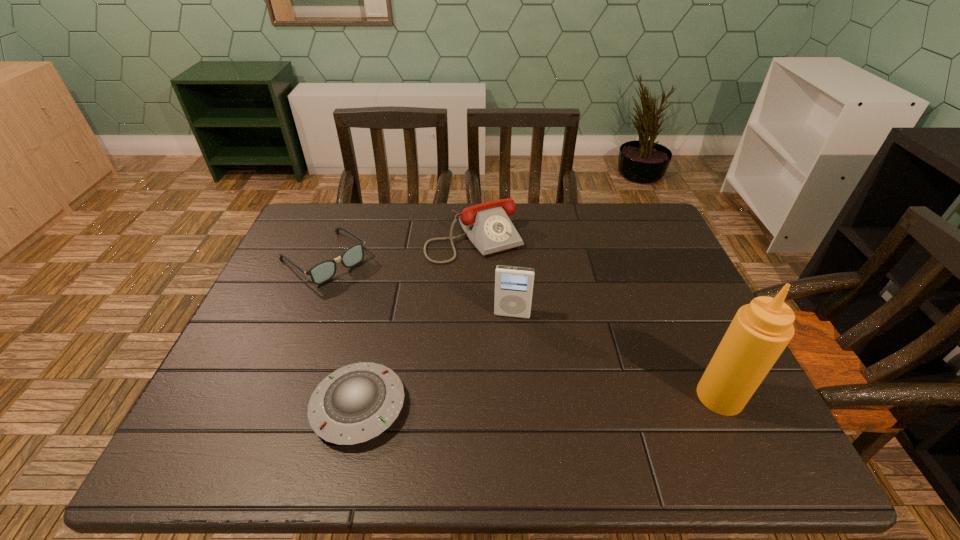
At what (x,y) coordinates should I click in order to perform the action: click on saucer. Please return your answer as a coordinate pair (x, y). The height and width of the screenshot is (540, 960). Looking at the image, I should click on (356, 403).

The image size is (960, 540). In order to click on the tallest object in this screenshot , I will do `click(760, 331)`.

The width and height of the screenshot is (960, 540). What are the coordinates of `the rightmost object` in the screenshot? It's located at (760, 331).

You are a GUI agent. You are given a task and a screenshot of the screen. Output one action in this format:
    pyautogui.click(x=<x>, y=<y>)
    Task: Click on the fourth shortest object
    Image resolution: width=960 pixels, height=540 pixels.
    Given the screenshot: What is the action you would take?
    pyautogui.click(x=513, y=285)

In order to click on the third nearest object in this screenshot , I will do `click(513, 285)`.

You are a GUI agent. You are given a task and a screenshot of the screen. Output one action in this format:
    pyautogui.click(x=<x>, y=<y>)
    Task: Click on the telephone
    The width and height of the screenshot is (960, 540).
    Given the screenshot: What is the action you would take?
    pyautogui.click(x=487, y=225)

Image resolution: width=960 pixels, height=540 pixels. What are the coordinates of `spectacles` in the screenshot? It's located at (323, 271).

The image size is (960, 540). I want to click on vacant space located on the right of the shortest object, so click(513, 407).

Find the location of `free space located 0.260m on the left of the rightmost object`. free space located 0.260m on the left of the rightmost object is located at coordinates (572, 396).

Locate an element on the screen. The height and width of the screenshot is (540, 960). free spot located on the front-facing side of the iPod is located at coordinates (508, 335).